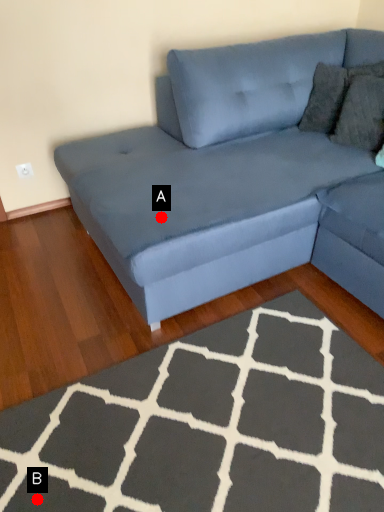
Question: Two points are circled on the image, labeled by A and B beside each circle. Which of the following is the closest to the observer?

Choices:
 (A) A is closer
 (B) B is closer

Answer: (B)